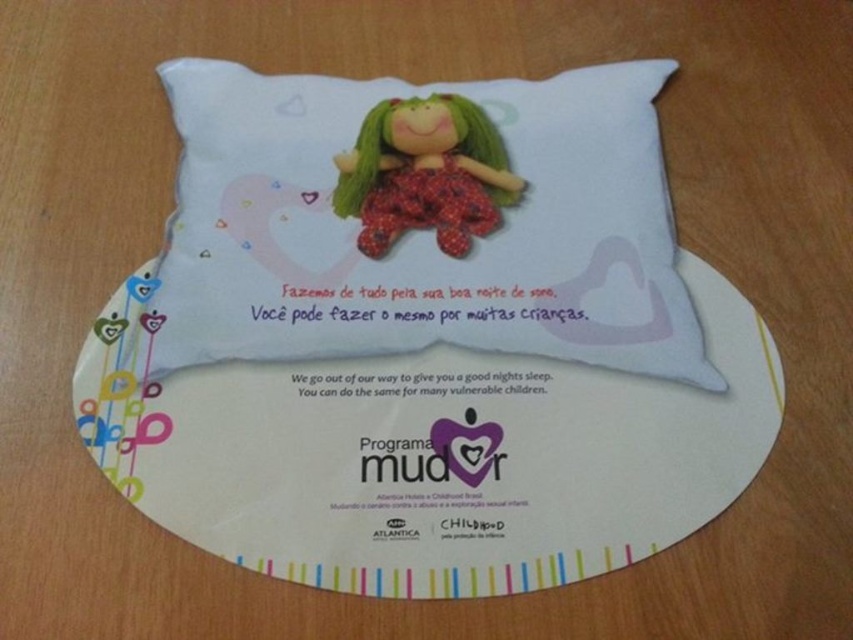
Is white soft pillow at center to the right of matte plastic doll at center from the viewer's perspective?

In fact, white soft pillow at center is to the left of matte plastic doll at center.

Who is more forward, (337, 336) or (357, 214)?

Point (337, 336) is in front.

Between point (543, 134) and point (335, 211), which one is positioned in front?

Positioned in front is point (335, 211).

This screenshot has width=853, height=640. Find the location of `white soft pillow at center`. white soft pillow at center is located at coordinates (422, 220).

Which is behind, point (228, 193) or point (442, 465)?

Point (228, 193)

Does white soft pillow at center come behind white paper plate at center?

Yes, it is.

Is point (599, 193) in front of point (343, 467)?

No, it is behind (343, 467).

The height and width of the screenshot is (640, 853). I want to click on white soft pillow at center, so click(422, 220).

Does point (735, 464) lie in front of point (409, 182)?

Yes, it is.

Is point (726, 502) positioned after point (418, 131)?

No, (726, 502) is closer to viewer.

This screenshot has height=640, width=853. I want to click on white paper plate at center, so click(x=431, y=456).